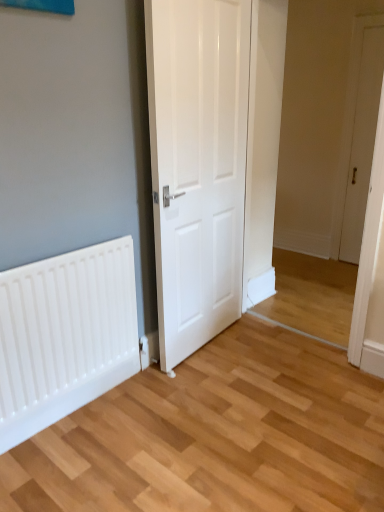
You are a GUI agent. You are given a task and a screenshot of the screen. Output one action in this format:
    pyautogui.click(x=<x>, y=<y>)
    Task: Click on the free space in front of white matte radiator at lower left
    
    Given the screenshot: What is the action you would take?
    pyautogui.click(x=96, y=450)